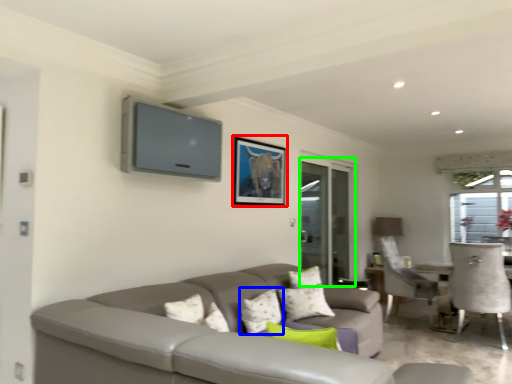
Question: Considering the real-world distances, which object is closest to picture frame (highlighted by a red box)? pillow (highlighted by a blue box) or screen door (highlighted by a green box).

Choices:
 (A) pillow
 (B) screen door

Answer: (A)